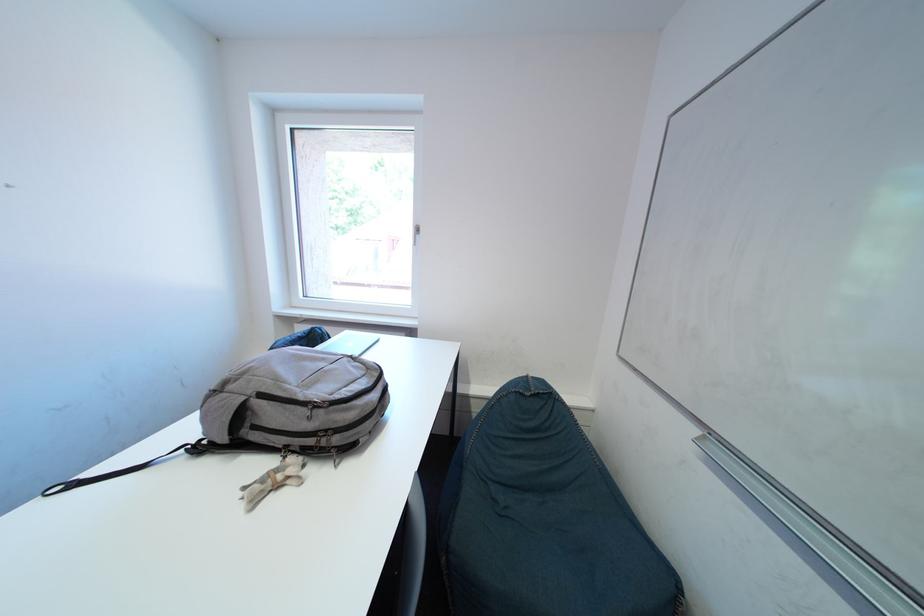
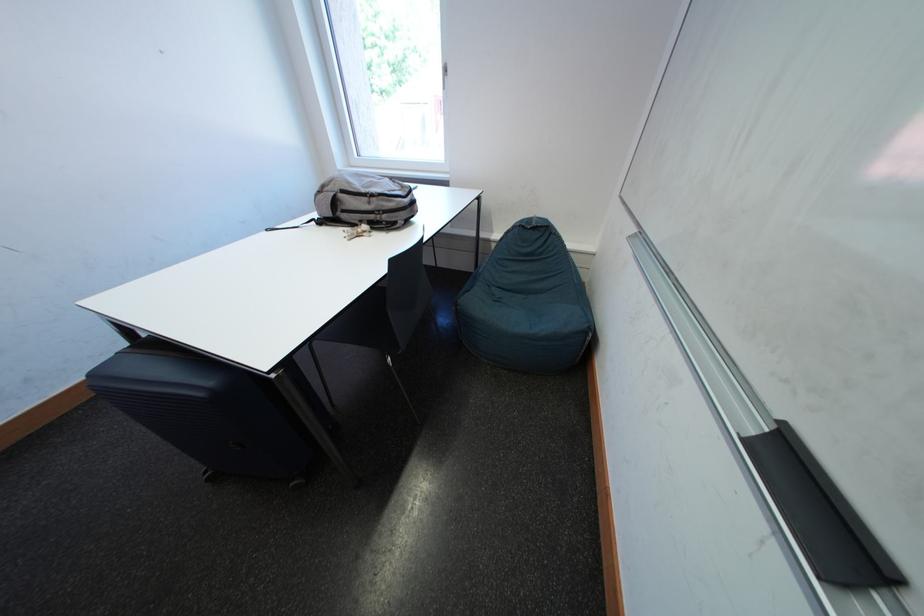
Find the pixel in the second image that matches point (384, 399) in the first image.

(416, 204)